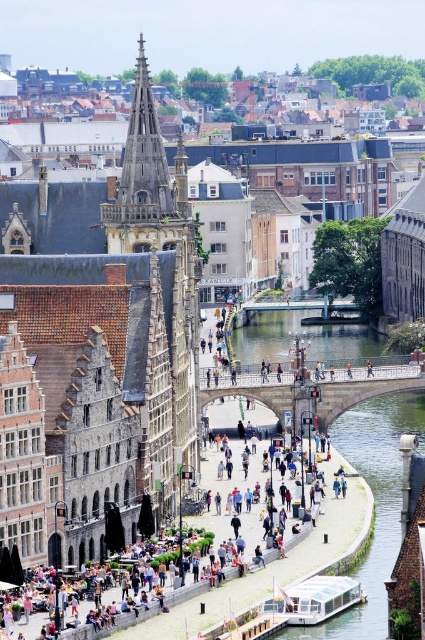
Question: Does clear water at bridge center appear over matte brown building at center?

Choices:
 (A) no
 (B) yes

Answer: (B)

Question: Is clear water at bridge center above matte brown building at center?

Choices:
 (A) yes
 (B) no

Answer: (A)

Question: Does clear water at bridge center lie in front of matte brown building at center?

Choices:
 (A) yes
 (B) no

Answer: (B)

Question: Which object appears closest to the camera in this image?

Choices:
 (A) matte brown building at center
 (B) clear water at bridge center

Answer: (A)